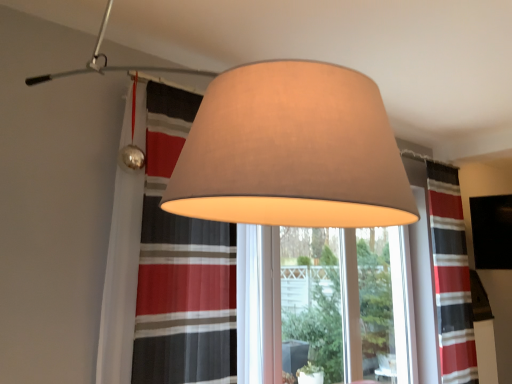
Question: From a real-world perspective, is matte gray lampshade at center, placed as the second lamp when sorted from back to front, on top of matte beige lampshade at upper center?

Choices:
 (A) yes
 (B) no

Answer: (A)

Question: Is matte gray lampshade at center, the first lamp when ordered from front to back, positioned far away from matte beige lampshade at upper center?

Choices:
 (A) no
 (B) yes

Answer: (B)

Question: Is matte gray lampshade at center, the first lamp when ordered from front to back, positioned with its back to matte beige lampshade at upper center?

Choices:
 (A) no
 (B) yes

Answer: (A)

Question: Does matte gray lampshade at center, the first lamp when ordered from front to back, have a lesser height compared to matte beige lampshade at upper center?

Choices:
 (A) no
 (B) yes

Answer: (B)

Question: Is matte gray lampshade at center, the first lamp when ordered from front to back, closer to the viewer compared to matte beige lampshade at upper center?

Choices:
 (A) yes
 (B) no

Answer: (A)

Question: From the image's perspective, is clear glass window frame at center positioned above or below matte gray lampshade at center, the first lamp when ordered from front to back?

Choices:
 (A) below
 (B) above

Answer: (A)

Question: Considering their positions, is clear glass window frame at center located in front of or behind matte gray lampshade at center, placed as the second lamp when sorted from back to front?

Choices:
 (A) front
 (B) behind

Answer: (B)

Question: Is clear glass window frame at center to the left or to the right of matte gray lampshade at center, the first lamp when ordered from front to back, in the image?

Choices:
 (A) right
 (B) left

Answer: (A)

Question: Is clear glass window frame at center bigger or smaller than matte gray lampshade at center, the first lamp when ordered from front to back?

Choices:
 (A) small
 (B) big

Answer: (A)

Question: Considering the positions of matte beige lampshade at upper center, the second lamp positioned from the front, and striped fabric curtain at right in the image, is matte beige lampshade at upper center, the second lamp positioned from the front, bigger or smaller than striped fabric curtain at right?

Choices:
 (A) small
 (B) big

Answer: (A)

Question: Considering the positions of matte beige lampshade at upper center, the second lamp positioned from the front, and striped fabric curtain at right in the image, is matte beige lampshade at upper center, the second lamp positioned from the front, taller or shorter than striped fabric curtain at right?

Choices:
 (A) tall
 (B) short

Answer: (B)

Question: Is matte beige lampshade at upper center, acting as the first lamp starting from the back, situated inside striped fabric curtain at right or outside?

Choices:
 (A) outside
 (B) inside

Answer: (A)

Question: From the image's perspective, is matte beige lampshade at upper center, the second lamp positioned from the front, above or below striped fabric curtain at right?

Choices:
 (A) above
 (B) below

Answer: (A)

Question: Would you say clear glass window frame at center is inside or outside matte beige lampshade at upper center?

Choices:
 (A) outside
 (B) inside

Answer: (A)

Question: From the image's perspective, relative to matte beige lampshade at upper center, is clear glass window frame at center above or below?

Choices:
 (A) below
 (B) above

Answer: (A)